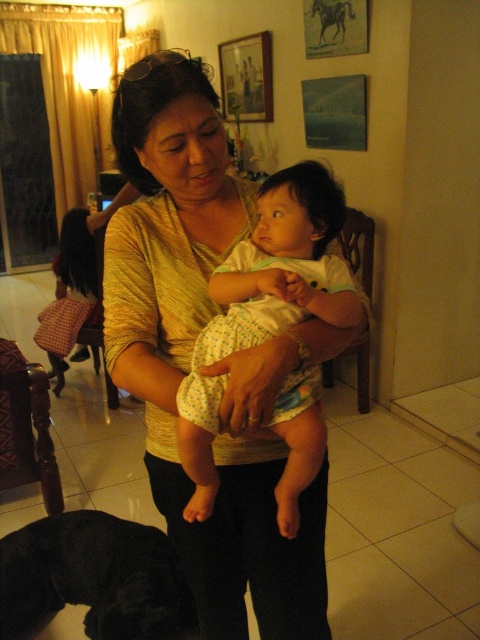
The height and width of the screenshot is (640, 480). Identify the location of yellow textured blouse at center. (213, 364).

The width and height of the screenshot is (480, 640). What do you see at coordinates (213, 364) in the screenshot?
I see `yellow textured blouse at center` at bounding box center [213, 364].

Is point (240, 216) in front of point (247, 83)?

That is True.

Where is `yellow textured blouse at center`? This screenshot has width=480, height=640. yellow textured blouse at center is located at coordinates (213, 364).

Is white dotted fabric baby at center taller than black fur dog at lower left?

Correct, white dotted fabric baby at center is much taller as black fur dog at lower left.

From the picture: Can you confirm if white dotted fabric baby at center is shorter than black fur dog at lower left?

In fact, white dotted fabric baby at center may be taller than black fur dog at lower left.

Where is `white dotted fabric baby at center`? This screenshot has width=480, height=640. white dotted fabric baby at center is located at coordinates point(263,301).

Locate an element on the screen. The image size is (480, 640). white dotted fabric baby at center is located at coordinates (263, 301).

Does black fur dog at lower left appear on the left side of wooden picture frame at upper center?

Yes, black fur dog at lower left is to the left of wooden picture frame at upper center.

Describe the element at coordinates (94, 577) in the screenshot. I see `black fur dog at lower left` at that location.

You are a GUI agent. You are given a task and a screenshot of the screen. Output one action in this format:
    pyautogui.click(x=<x>, y=<y>)
    Task: Click on the black fur dog at lower left
    The image size is (480, 640).
    Given the screenshot: What is the action you would take?
    pyautogui.click(x=94, y=577)

The image size is (480, 640). Identify the location of black fur dog at lower left. (94, 577).